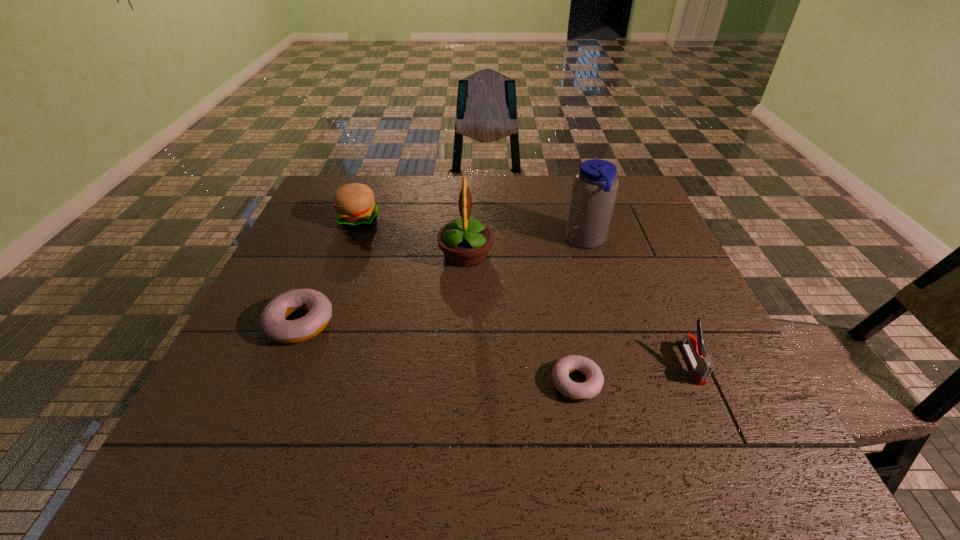
The image size is (960, 540). In the image, there is a desktop. What are the coordinates of `vacant space at the near right corner` in the screenshot? It's located at (704, 405).

At what (x,y) coordinates should I click in order to perform the action: click on vacant space that is in between the water bottle and the fourth object from right to left. Please return your answer as a coordinate pair (x, y). This screenshot has width=960, height=540. Looking at the image, I should click on (526, 248).

I want to click on free space between the fifth tallest object and the water bottle, so click(444, 282).

Identify the location of unoccupied position between the fifth tallest object and the third object from left to right. The height and width of the screenshot is (540, 960). (383, 289).

At what (x,y) coordinates should I click in order to perform the action: click on free space between the hamburger and the sunflower. Please return your answer as a coordinate pair (x, y). Looking at the image, I should click on (412, 238).

Where is `free space between the farther doughnut and the fourth object from right to left`? free space between the farther doughnut and the fourth object from right to left is located at coordinates (383, 289).

Where is `vacant space that's between the hamburger and the farther doughnut`? vacant space that's between the hamburger and the farther doughnut is located at coordinates (329, 272).

The width and height of the screenshot is (960, 540). Find the location of `empty location between the stapler and the water bottle`. empty location between the stapler and the water bottle is located at coordinates (639, 302).

Locate an element on the screen. This screenshot has height=540, width=960. free space between the farther doughnut and the rightmost object is located at coordinates (495, 343).

The height and width of the screenshot is (540, 960). Identify the location of vacant area that lies between the shortest object and the sunflower. (521, 319).